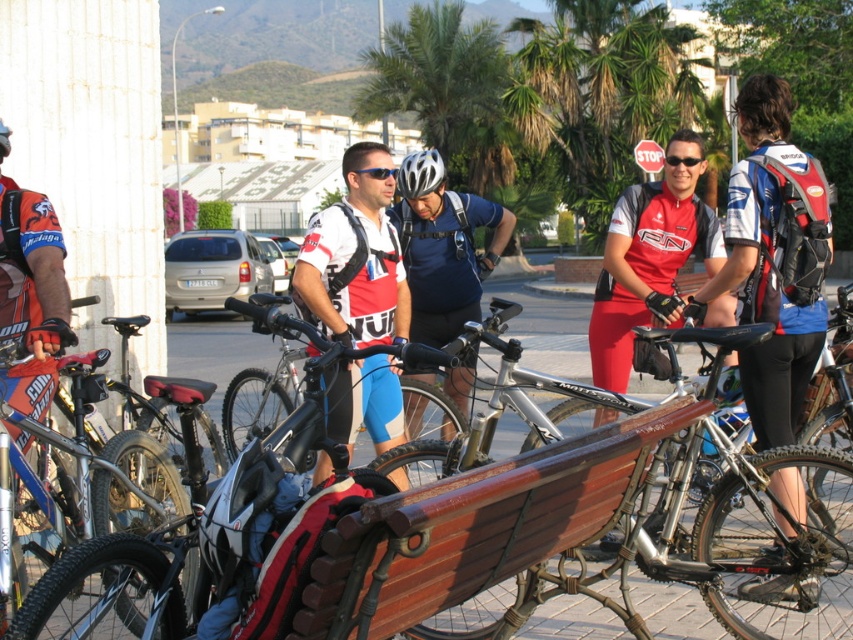
Does blue reflective lens glasses at center appear under black matte bicycle helmet at left?

Actually, blue reflective lens glasses at center is above black matte bicycle helmet at left.

Does blue reflective lens glasses at center lie behind black matte bicycle helmet at left?

Yes, blue reflective lens glasses at center is further from the viewer.

What are the coordinates of `blue reflective lens glasses at center` in the screenshot? It's located at (378, 172).

Image resolution: width=853 pixels, height=640 pixels. What do you see at coordinates (450, 532) in the screenshot? I see `silver metallic bicycle at center` at bounding box center [450, 532].

You are a GUI agent. You are given a task and a screenshot of the screen. Output one action in this format:
    pyautogui.click(x=<x>, y=<y>)
    Task: Click on the silver metallic bicycle at center
    Image resolution: width=853 pixels, height=640 pixels.
    Given the screenshot: What is the action you would take?
    pyautogui.click(x=450, y=532)

Does silver metallic bicycle at center have a lesser height compared to blue fabric jersey at center?

Correct, silver metallic bicycle at center is not as tall as blue fabric jersey at center.

Who is more forward, (318,554) or (782,317)?

Point (318,554) is in front.

I want to click on silver metallic bicycle at center, so click(450, 532).